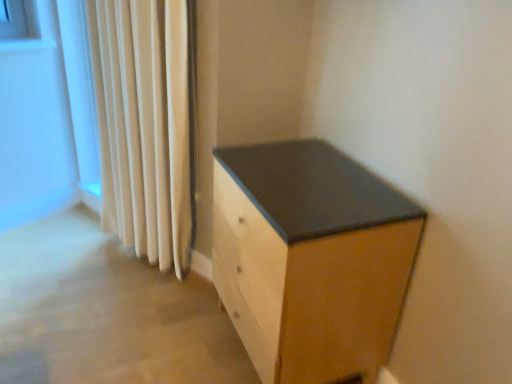
Find the location of a particular element. free spot in front of beige fabric curtain at left is located at coordinates (141, 306).